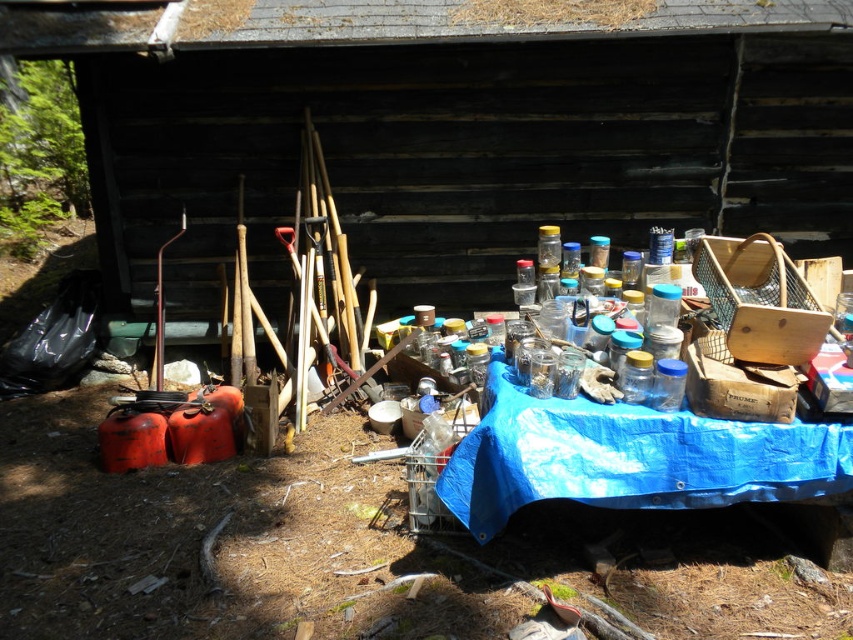
Which of these two, transparent plastic containers at center or blue tarpaulin table at center, stands shorter?

blue tarpaulin table at center

How far apart are transparent plastic containers at center and blue tarpaulin table at center?

The distance of transparent plastic containers at center from blue tarpaulin table at center is 8.53 feet.

Who is more forward, [679,68] or [811,442]?

Point [811,442] is in front.

I want to click on transparent plastic containers at center, so click(451, 129).